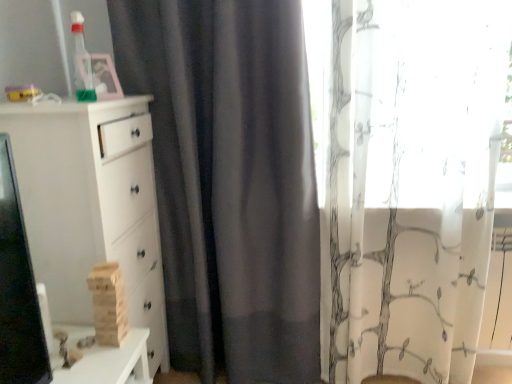
Question: Considering the relative sizes of transparent plastic bottle at upper left, which ranks as the second toy in right-to-left order, and white matte chest of drawers at left in the image provided, is transparent plastic bottle at upper left, which ranks as the second toy in right-to-left order, thinner than white matte chest of drawers at left?

Choices:
 (A) yes
 (B) no

Answer: (A)

Question: Does transparent plastic bottle at upper left, arranged as the first toy when viewed from the top, lie in front of white matte chest of drawers at left?

Choices:
 (A) yes
 (B) no

Answer: (B)

Question: Is the position of transparent plastic bottle at upper left, which is the first toy from left to right, more distant than that of white matte chest of drawers at left?

Choices:
 (A) no
 (B) yes

Answer: (B)

Question: Could you tell me if transparent plastic bottle at upper left, which is the first toy from left to right, is facing white matte chest of drawers at left?

Choices:
 (A) yes
 (B) no

Answer: (B)

Question: From a real-world perspective, is transparent plastic bottle at upper left, which is the first toy from left to right, over white matte chest of drawers at left?

Choices:
 (A) yes
 (B) no

Answer: (A)

Question: Looking at their shapes, would you say white sheer curtain at right is wider or thinner than white matte chest of drawers at left?

Choices:
 (A) wide
 (B) thin

Answer: (B)

Question: Is white sheer curtain at right inside the boundaries of white matte chest of drawers at left, or outside?

Choices:
 (A) outside
 (B) inside

Answer: (A)

Question: Is point (434, 317) positioned closer to the camera than point (136, 271)?

Choices:
 (A) farther
 (B) closer

Answer: (A)

Question: Considering the relative positions of white sheer curtain at right and white matte chest of drawers at left in the image provided, is white sheer curtain at right to the left or to the right of white matte chest of drawers at left?

Choices:
 (A) right
 (B) left

Answer: (A)

Question: From a real-world perspective, is wooden blocks at left, which is the 1th toy from bottom to top, physically located above or below white sheer curtain at right?

Choices:
 (A) below
 (B) above

Answer: (A)

Question: Which is correct: wooden blocks at left, which is the second toy in left-to-right order, is inside white sheer curtain at right, or outside of it?

Choices:
 (A) inside
 (B) outside

Answer: (B)

Question: Looking at the image, does wooden blocks at left, the 2th toy positioned from the top, seem bigger or smaller compared to white sheer curtain at right?

Choices:
 (A) big
 (B) small

Answer: (B)

Question: From the image's perspective, is wooden blocks at left, which is the second toy in left-to-right order, positioned above or below white sheer curtain at right?

Choices:
 (A) above
 (B) below

Answer: (B)

Question: Is white sheer curtain at right wider or thinner than transparent plastic bottle at upper left, arranged as the first toy when viewed from the top?

Choices:
 (A) thin
 (B) wide

Answer: (B)

Question: Would you say white sheer curtain at right is inside or outside transparent plastic bottle at upper left, arranged as the first toy when viewed from the top?

Choices:
 (A) outside
 (B) inside

Answer: (A)